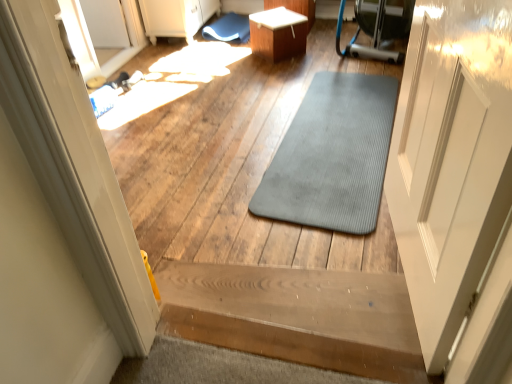
Question: Visually, is gray rubber mat at center positioned to the left or to the right of wooden stairs at center?

Choices:
 (A) left
 (B) right

Answer: (B)

Question: Considering the positions of gray rubber mat at center and wooden stairs at center in the image, is gray rubber mat at center taller or shorter than wooden stairs at center?

Choices:
 (A) tall
 (B) short

Answer: (B)

Question: Which object is positioned closest to the transparent glass door at upper left?

Choices:
 (A) blue rubber bath mat at upper center
 (B) gray rubber mat at center
 (C) wooden stairs at center
 (D) white glossy table at upper center

Answer: (A)

Question: Considering the real-world distances, which object is closest to the gray rubber mat at center?

Choices:
 (A) wooden stairs at center
 (B) transparent glass door at upper left
 (C) blue rubber bath mat at upper center
 (D) white glossy table at upper center

Answer: (A)